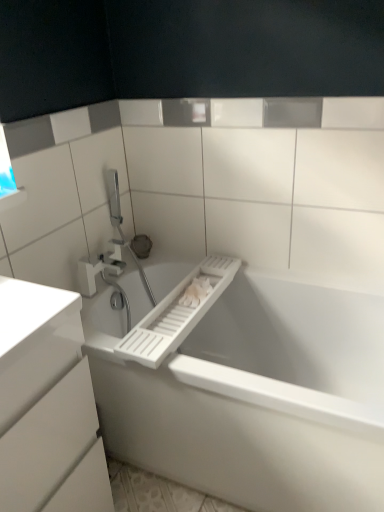
Question: Is white plastic towel bar at center behind transparent glass window at upper left?

Choices:
 (A) yes
 (B) no

Answer: (B)

Question: Is white plastic towel bar at center smaller than transparent glass window at upper left?

Choices:
 (A) yes
 (B) no

Answer: (B)

Question: Is white plastic towel bar at center next to transparent glass window at upper left?

Choices:
 (A) yes
 (B) no

Answer: (B)

Question: Is white plastic towel bar at center far from transparent glass window at upper left?

Choices:
 (A) yes
 (B) no

Answer: (B)

Question: Can you confirm if white plastic towel bar at center is shorter than transparent glass window at upper left?

Choices:
 (A) no
 (B) yes

Answer: (B)

Question: Is white plastic towel bar at center outside of transparent glass window at upper left?

Choices:
 (A) yes
 (B) no

Answer: (A)

Question: Is white plastic tap at upper left bigger than white plastic bathtub at lower left?

Choices:
 (A) yes
 (B) no

Answer: (B)

Question: Is white plastic tap at upper left facing towards white plastic bathtub at lower left?

Choices:
 (A) yes
 (B) no

Answer: (B)

Question: Is the position of white plastic tap at upper left more distant than that of white plastic bathtub at lower left?

Choices:
 (A) yes
 (B) no

Answer: (A)

Question: Is white plastic tap at upper left not inside white plastic bathtub at lower left?

Choices:
 (A) yes
 (B) no

Answer: (A)

Question: Considering the relative sizes of white plastic tap at upper left and white plastic bathtub at lower left in the image provided, is white plastic tap at upper left taller than white plastic bathtub at lower left?

Choices:
 (A) no
 (B) yes

Answer: (A)

Question: From the image's perspective, does white plastic tap at upper left appear higher than white plastic bathtub at lower left?

Choices:
 (A) no
 (B) yes

Answer: (B)

Question: Is white plastic tap at upper left not close to white plastic towel bar at center?

Choices:
 (A) yes
 (B) no

Answer: (B)